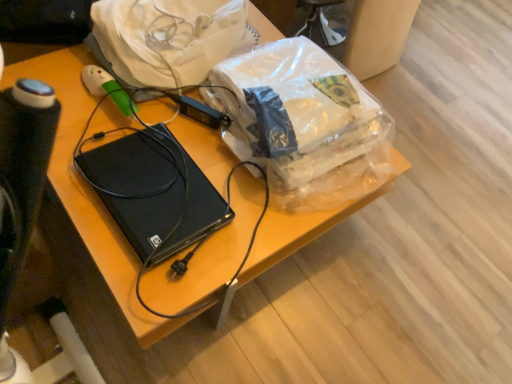
Question: Does black plastic computer at center have a lesser height compared to translucent plastic bag at center?

Choices:
 (A) yes
 (B) no

Answer: (A)

Question: Considering the relative sizes of black plastic computer at center and translucent plastic bag at center in the image provided, is black plastic computer at center smaller than translucent plastic bag at center?

Choices:
 (A) yes
 (B) no

Answer: (A)

Question: Is black plastic computer at center completely or partially outside of translucent plastic bag at center?

Choices:
 (A) yes
 (B) no

Answer: (A)

Question: Is black plastic computer at center oriented towards translucent plastic bag at center?

Choices:
 (A) no
 (B) yes

Answer: (B)

Question: From a real-world perspective, is black plastic computer at center positioned under translucent plastic bag at center based on gravity?

Choices:
 (A) yes
 (B) no

Answer: (A)

Question: Is black plastic computer at center at the left side of translucent plastic bag at center?

Choices:
 (A) yes
 (B) no

Answer: (A)

Question: Is translucent plastic bag at center located outside black plastic computer at center?

Choices:
 (A) yes
 (B) no

Answer: (A)

Question: Is translucent plastic bag at center facing away from black plastic computer at center?

Choices:
 (A) yes
 (B) no

Answer: (B)

Question: Does translucent plastic bag at center appear on the left side of black plastic computer at center?

Choices:
 (A) yes
 (B) no

Answer: (B)

Question: From a real-world perspective, is translucent plastic bag at center physically above black plastic computer at center?

Choices:
 (A) no
 (B) yes

Answer: (B)

Question: Is translucent plastic bag at center taller than black plastic computer at center?

Choices:
 (A) yes
 (B) no

Answer: (A)

Question: From the image's perspective, is translucent plastic bag at center on black plastic computer at center?

Choices:
 (A) no
 (B) yes

Answer: (B)

Question: Is white plastic bag at upper center not close to translucent plastic bag at center?

Choices:
 (A) yes
 (B) no

Answer: (B)